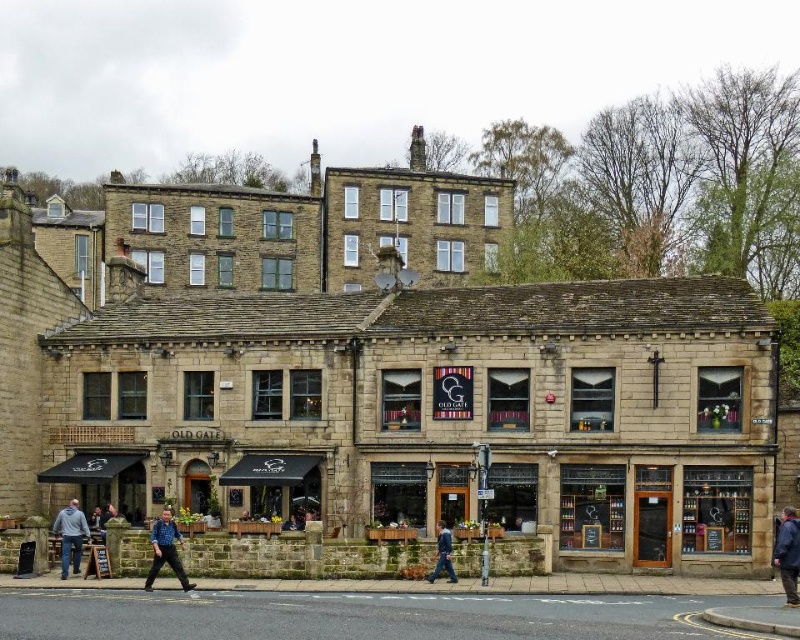
Which is above, blue fabric jacket at lower right or blue denim jeans at lower left?

blue fabric jacket at lower right is above.

Is blue fabric jacket at lower right smaller than blue denim jeans at lower left?

Incorrect, blue fabric jacket at lower right is not smaller in size than blue denim jeans at lower left.

Which is behind, point (776, 544) or point (164, 513)?

Point (164, 513)

This screenshot has width=800, height=640. I want to click on blue fabric jacket at lower right, so pos(788,554).

Does stone building at center have a greater height compared to blue denim jeans at lower left?

→ Yes.

Can you confirm if stone building at center is bigger than blue denim jeans at lower left?

Yes, stone building at center is bigger than blue denim jeans at lower left.

I want to click on stone building at center, so click(441, 412).

Who is more forward, (762, 444) or (70, 506)?

Point (762, 444)

Where is `stone building at center`? The image size is (800, 640). stone building at center is located at coordinates (441, 412).